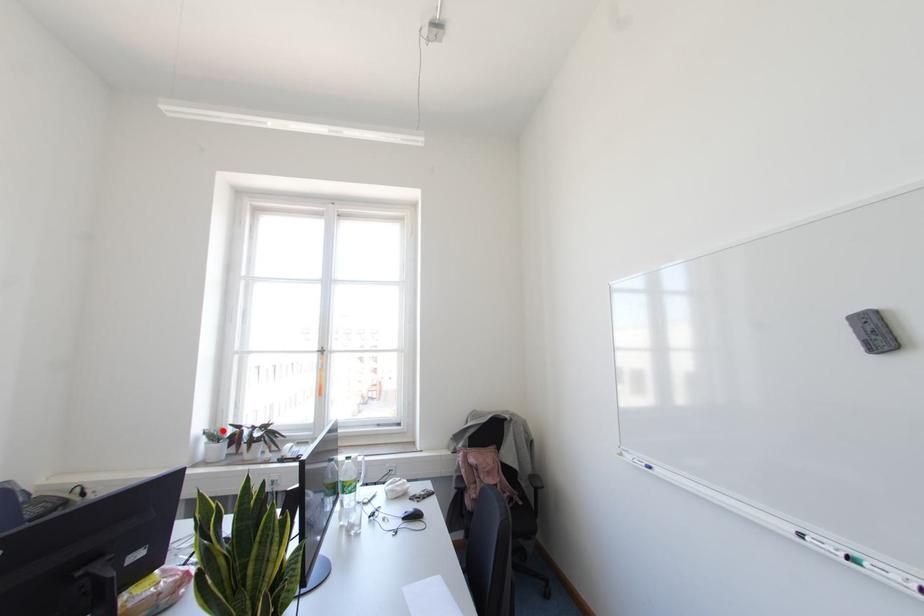
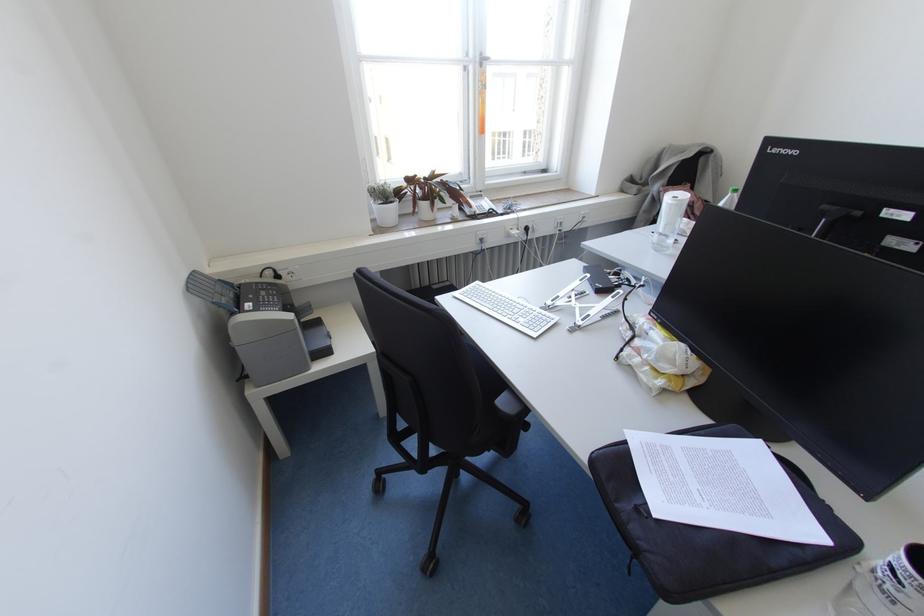
Question: I am providing you with two images of the same scene from different viewpoints. A red point is marked on the first image. Is the red point's position out of view in image 2?

Choices:
 (A) Yes
 (B) No

Answer: (B)